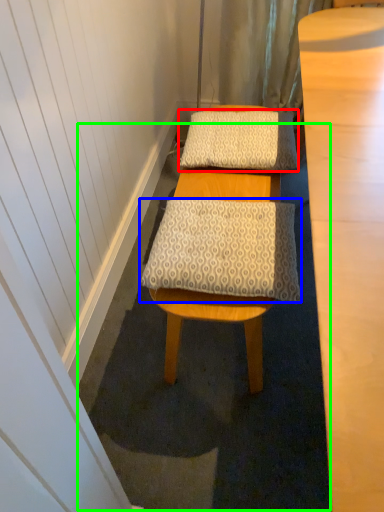
Question: Which object is positioned closest to pillow (highlighted by a red box)? Select from pillow (highlighted by a blue box) and bath mat (highlighted by a green box).

Choices:
 (A) pillow
 (B) bath mat

Answer: (A)